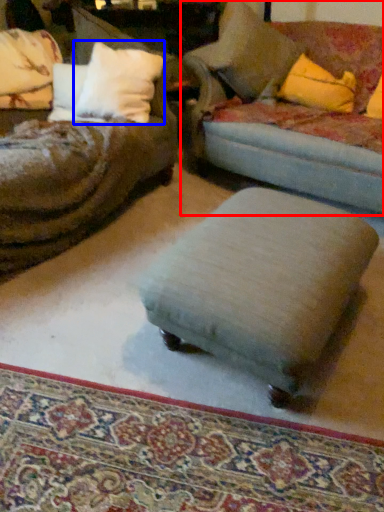
Question: Which object appears farthest to the camera in this image, studio couch (highlighted by a red box) or pillow (highlighted by a blue box)?

Choices:
 (A) studio couch
 (B) pillow

Answer: (B)